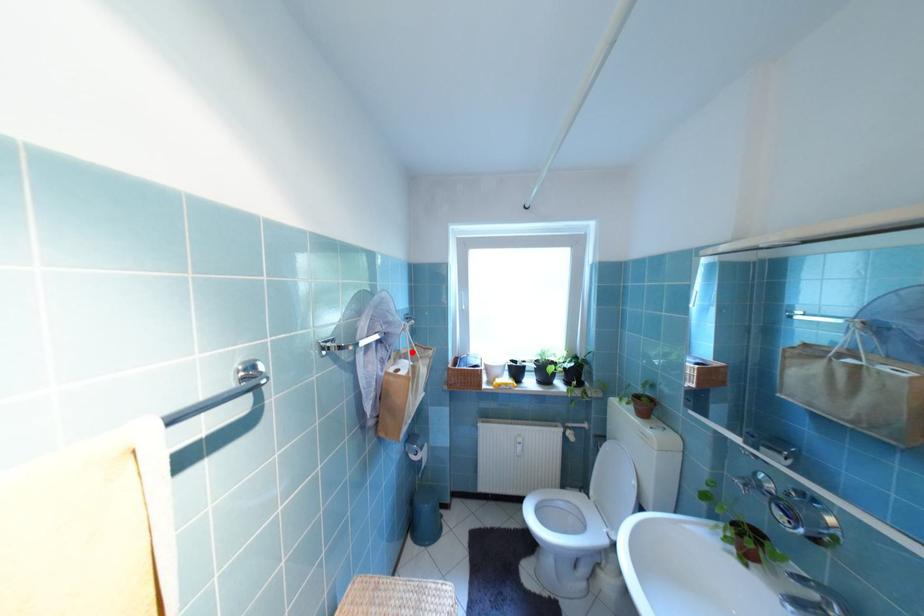
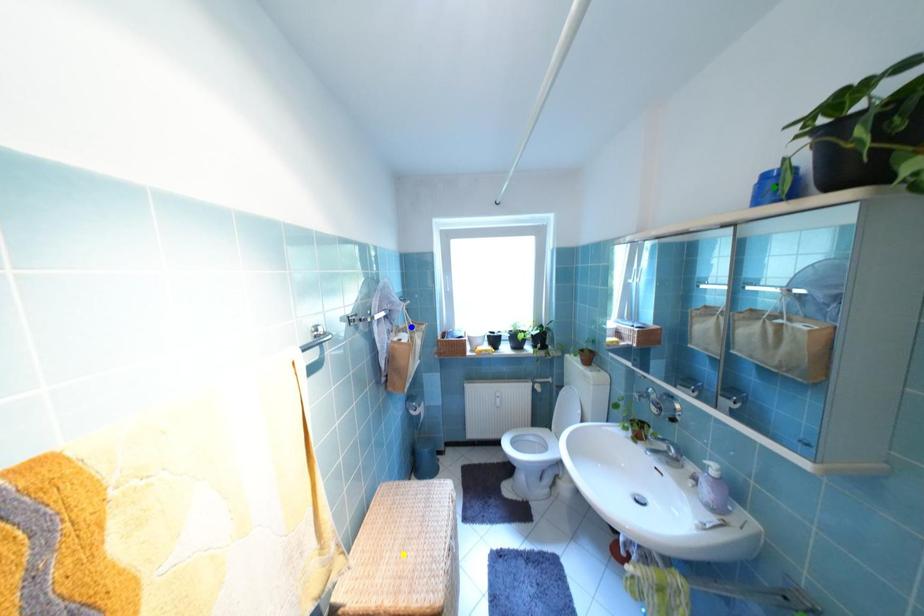
Question: I am providing you with two images of the same scene from different viewpoints. A red point is marked on the first image. You are given multiple points on the second image. Which spot in image 2 lines up with the point in image 1?

Choices:
 (A) yellow point
 (B) blue point
 (C) green point

Answer: (B)